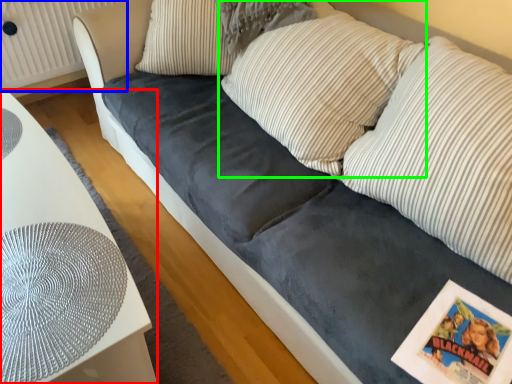
Question: Based on their relative distances, which object is farther from furniture (highlighted by a red box)? Choose from radiator (highlighted by a blue box) and pillow (highlighted by a green box).

Choices:
 (A) radiator
 (B) pillow

Answer: (A)